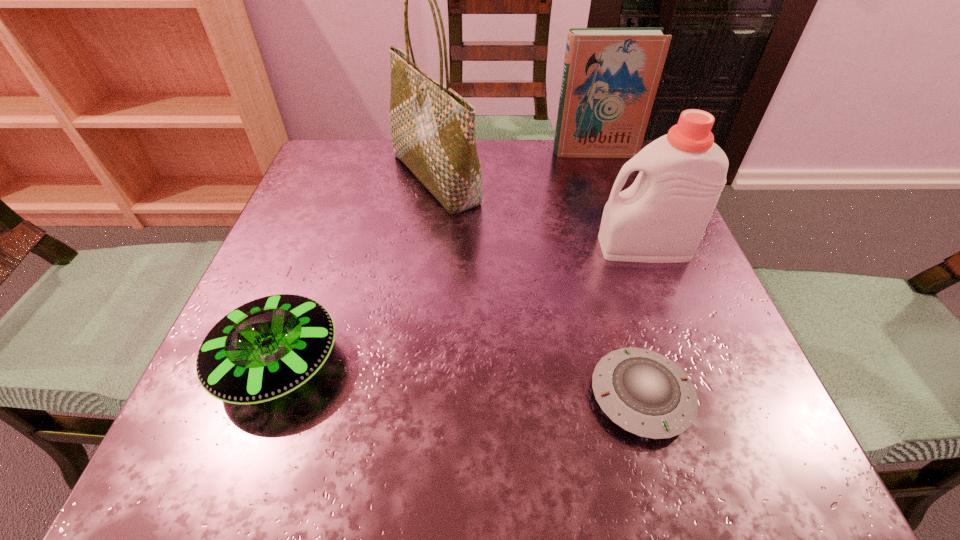
Image resolution: width=960 pixels, height=540 pixels. I want to click on vacant space that is in between the hardback book and the leftmost object, so click(437, 258).

I want to click on vacant area that lies between the detergent and the leftmost object, so click(461, 305).

The width and height of the screenshot is (960, 540). I want to click on free space between the shorter saucer and the fourth object from right to left, so click(538, 287).

Find the location of a particular element. The height and width of the screenshot is (540, 960). vacant area that lies between the hardback book and the shopping bag is located at coordinates (515, 166).

I want to click on empty space that is in between the second object from left to right and the shorter saucer, so click(x=538, y=287).

Where is `free area in between the shorter saucer and the tallest object`? free area in between the shorter saucer and the tallest object is located at coordinates (538, 287).

Identify which object is the closest to the shopping bag. Please provide its 2D coordinates. Your answer should be formatted as a tuple, i.e. [(x, y)], where the tuple contains the x and y coordinates of a point satisfying the conditions above.

[(610, 77)]

Select which object is the third closest to the second shortest object. Please provide its 2D coordinates. Your answer should be formatted as a tuple, i.e. [(x, y)], where the tuple contains the x and y coordinates of a point satisfying the conditions above.

[(661, 218)]